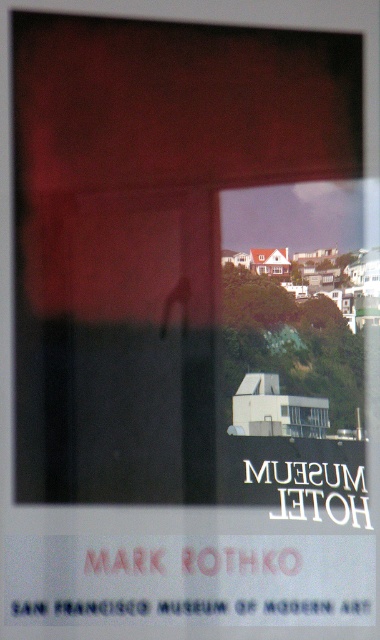
You are an interior designer trying to decide between the transparent glass window at center and the matte glass window at center for a new project. Based on the image, which window option allows for a clearer view of the scenic hilly background?

The transparent glass window at center allows for a clearer view of the scenic hilly background because it is wider than the matte glass window at center.

You are standing in front of the promotional poster for the San Francisco Museum of Modern Art. There is a point at coordinate (277, 269) on the poster. What object is located at this coordinate?

The point at coordinate (277, 269) corresponds to the transparent glass window at center.